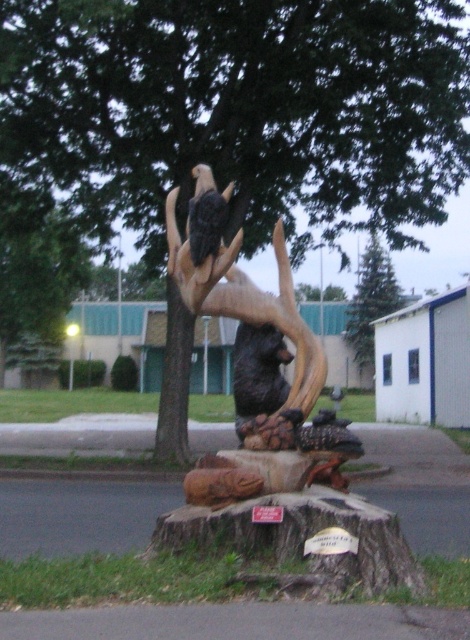
At what (x,y) coordinates should I click in order to perform the action: click on wooden bear statue at center. Please return your answer as a coordinate pair (x, y). This screenshot has height=640, width=470. Looking at the image, I should click on (260, 326).

Does dark brown wood bear at center have a smaller size compared to green textured pine tree at upper center?

Indeed, dark brown wood bear at center has a smaller size compared to green textured pine tree at upper center.

This screenshot has width=470, height=640. I want to click on dark brown wood bear at center, so click(258, 371).

Is point (109, 13) farther from viewer compared to point (219, 195)?

Yes, point (109, 13) is farther from viewer.

Who is shorter, wooden sculpture at center or dark brown wood eagle at upper center?

dark brown wood eagle at upper center is shorter.

What do you see at coordinates (232, 113) in the screenshot? Image resolution: width=470 pixels, height=640 pixels. I see `wooden sculpture at center` at bounding box center [232, 113].

The width and height of the screenshot is (470, 640). Find the location of `wooden sculpture at center`. wooden sculpture at center is located at coordinates (232, 113).